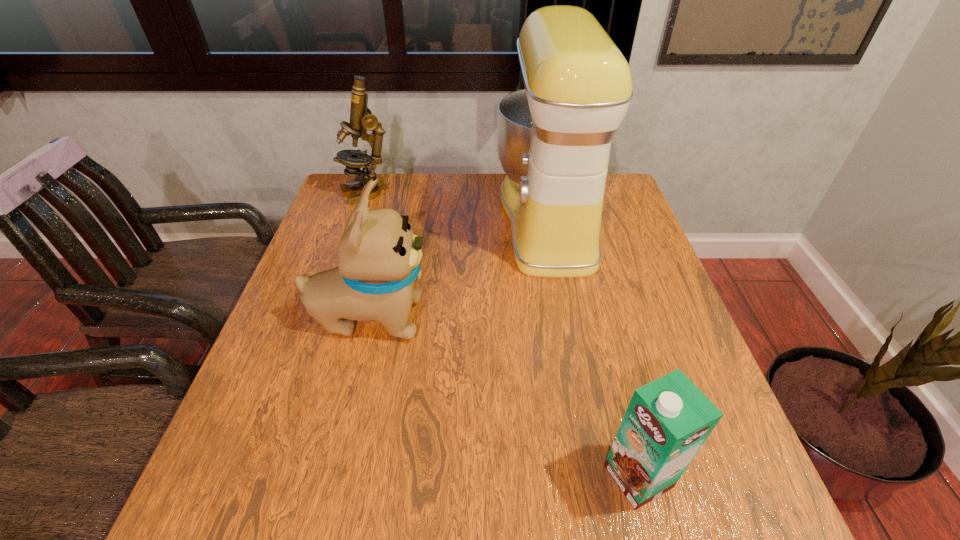
Find the location of a particular element. vacant area situated 0.090m on the left of the carton is located at coordinates (554, 476).

Identify the location of mixer situated at the far edge. (554, 137).

Find the location of `microscope that is at the far edge`. microscope that is at the far edge is located at coordinates 361,118.

Where is `object that is positioned at the near edge`? The width and height of the screenshot is (960, 540). object that is positioned at the near edge is located at coordinates (668, 420).

The image size is (960, 540). Find the location of `microscope situated at the left edge`. microscope situated at the left edge is located at coordinates (361, 118).

Identify the location of puppy that is at the left edge. (379, 259).

Identify the location of mixer at the right edge. (554, 137).

Find the location of a particular element. carton that is at the right edge is located at coordinates click(668, 420).

The height and width of the screenshot is (540, 960). Identify the location of object that is at the far left corner. (361, 118).

The height and width of the screenshot is (540, 960). In order to click on object located in the far right corner section of the desktop in this screenshot , I will do `click(554, 137)`.